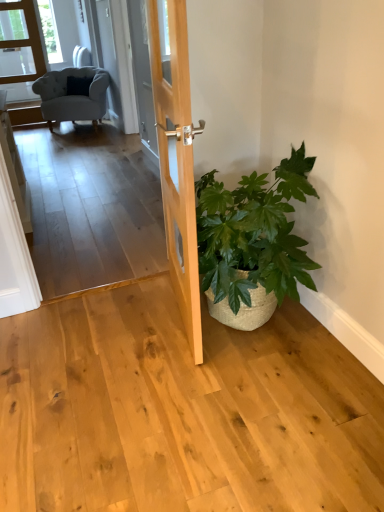
Identify the location of free space to the left of green woven basket at lower right. tap(107, 356).